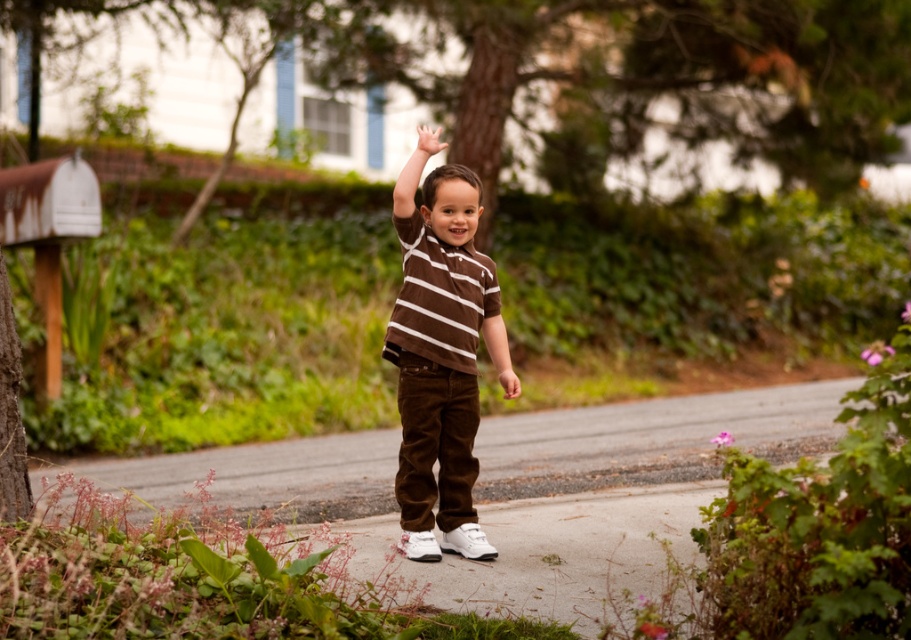
Can you confirm if brown corduroy pants at center is shorter than white matte hand at upper center?

Correct, brown corduroy pants at center is not as tall as white matte hand at upper center.

Is point (441, 420) behind point (432, 147)?

Yes, point (441, 420) is behind point (432, 147).

Where is `brown corduroy pants at center`? The image size is (911, 640). brown corduroy pants at center is located at coordinates (439, 356).

Between gray asphalt pavement at center and brown velvety shirt at center, which one is positioned higher?

brown velvety shirt at center is above.

Measure the distance between gray asphalt pavement at center and camera.

A distance of 8.61 meters exists between gray asphalt pavement at center and camera.

This screenshot has width=911, height=640. I want to click on gray asphalt pavement at center, so click(651, 438).

Who is more distant from viewer, (449, 224) or (510, 378)?

Point (510, 378)

Is point (398, 472) in front of point (486, 337)?

Yes, it is in front of point (486, 337).

Does point (449, 444) lie behind point (496, 326)?

No, (449, 444) is in front of (496, 326).

The height and width of the screenshot is (640, 911). In order to click on brown corduroy pants at center in this screenshot , I will do `click(439, 356)`.